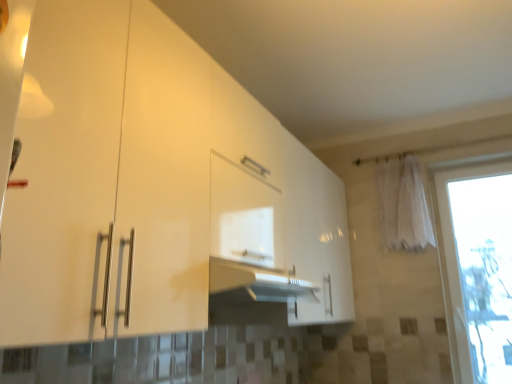
Question: Considering their positions, is white fabric curtain at upper right located in front of or behind white glossy cabinet at center?

Choices:
 (A) behind
 (B) front

Answer: (A)

Question: Looking at the image, does white fabric curtain at upper right seem bigger or smaller compared to white glossy cabinet at center?

Choices:
 (A) small
 (B) big

Answer: (A)

Question: Which object is positioned farthest from the white fabric curtain at upper right?

Choices:
 (A) transparent glass window at right
 (B) white glossy cabinet at center

Answer: (B)

Question: Which object is positioned closest to the transparent glass window at right?

Choices:
 (A) white glossy cabinet at center
 (B) white fabric curtain at upper right

Answer: (B)